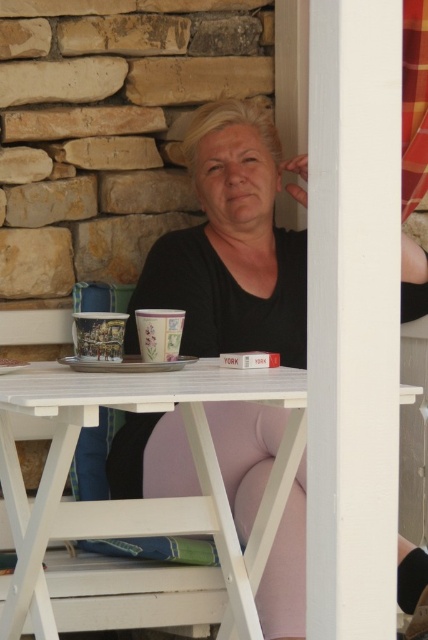
Question: Which point appears farthest from the camera in this image?

Choices:
 (A) (398, 24)
 (B) (118, 396)

Answer: (B)

Question: Is white painted wood at right thinner than matte black shirt at center?

Choices:
 (A) no
 (B) yes

Answer: (B)

Question: Is matte black shirt at center positioned before white wood picnic table at center?

Choices:
 (A) no
 (B) yes

Answer: (A)

Question: Can you confirm if white painted wood at right is positioned to the right of white wood picnic table at center?

Choices:
 (A) no
 (B) yes

Answer: (B)

Question: Which object is closer to the camera taking this photo?

Choices:
 (A) matte black shirt at center
 (B) white painted wood at right

Answer: (B)

Question: Which point is farther to the camera?

Choices:
 (A) (190, 131)
 (B) (312, 573)

Answer: (A)